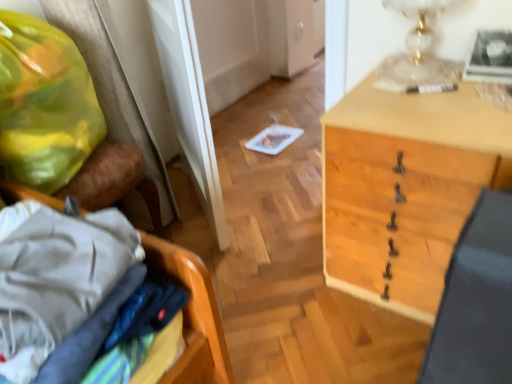
At what (x,y) coordinates should I click in order to perform the action: click on free space above wooden desk at center (from a real-world perspective). Please return your answer as a coordinate pair (x, y). This screenshot has width=512, height=384. Looking at the image, I should click on (437, 91).